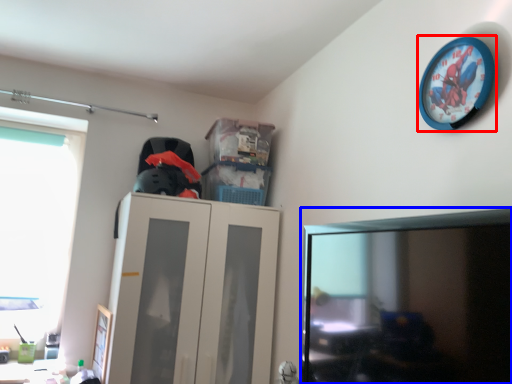
Question: Which of the following is the closest to the observer, wall clock (highlighted by a red box) or computer monitor (highlighted by a blue box)?

Choices:
 (A) wall clock
 (B) computer monitor

Answer: (B)